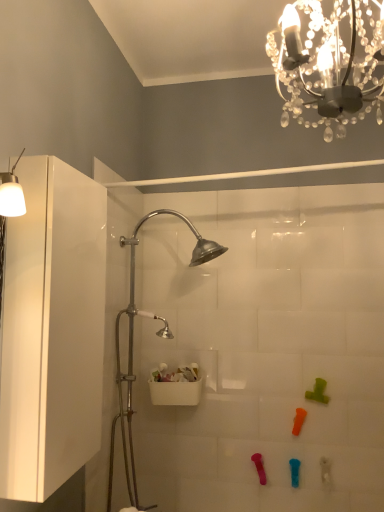
Question: Is translucent plastic toy at lower right, which is the 5th toy from left to right, positioned beyond the bounds of white plastic shower door at center?

Choices:
 (A) yes
 (B) no

Answer: (A)

Question: From the image's perspective, is translucent plastic toy at lower right, arranged as the 1th toy when viewed from the right, above white plastic shower door at center?

Choices:
 (A) no
 (B) yes

Answer: (A)

Question: Does translucent plastic toy at lower right, arranged as the 1th toy when viewed from the right, appear on the left side of white plastic shower door at center?

Choices:
 (A) yes
 (B) no

Answer: (B)

Question: Is translucent plastic toy at lower right, which is the 5th toy from left to right, positioned with its back to white plastic shower door at center?

Choices:
 (A) no
 (B) yes

Answer: (A)

Question: Considering the relative positions of translucent plastic toy at lower right, arranged as the 1th toy when viewed from the right, and white plastic shower door at center in the image provided, is translucent plastic toy at lower right, arranged as the 1th toy when viewed from the right, behind white plastic shower door at center?

Choices:
 (A) no
 (B) yes

Answer: (B)

Question: Does point (322, 463) appear closer or farther from the camera than point (162, 372)?

Choices:
 (A) closer
 (B) farther

Answer: (A)

Question: Based on their positions, is translucent plastic toy at lower right, arranged as the 1th toy when viewed from the right, located to the left or right of white plastic container at center?

Choices:
 (A) right
 (B) left

Answer: (A)

Question: Is translucent plastic toy at lower right, which is the 5th toy from left to right, inside the boundaries of white plastic container at center, or outside?

Choices:
 (A) inside
 (B) outside

Answer: (B)

Question: From a real-world perspective, is translucent plastic toy at lower right, arranged as the 1th toy when viewed from the right, above or below white plastic container at center?

Choices:
 (A) above
 (B) below

Answer: (B)

Question: Based on their sizes in the image, would you say white plastic container at center is bigger or smaller than clear crystal chandelier at upper center?

Choices:
 (A) big
 (B) small

Answer: (B)

Question: From a real-world perspective, is white plastic container at center positioned above or below clear crystal chandelier at upper center?

Choices:
 (A) below
 (B) above

Answer: (A)

Question: From the image's perspective, is white plastic container at center located above or below clear crystal chandelier at upper center?

Choices:
 (A) above
 (B) below

Answer: (B)

Question: Does point (178, 402) appear closer or farther from the camera than point (289, 31)?

Choices:
 (A) closer
 (B) farther

Answer: (B)

Question: In terms of size, does orange rubber toy at lower center, the third toy viewed from the left, appear bigger or smaller than clear crystal chandelier at upper center?

Choices:
 (A) big
 (B) small

Answer: (B)

Question: Looking at their shapes, would you say orange rubber toy at lower center, the third toy viewed from the left, is wider or thinner than clear crystal chandelier at upper center?

Choices:
 (A) thin
 (B) wide

Answer: (A)